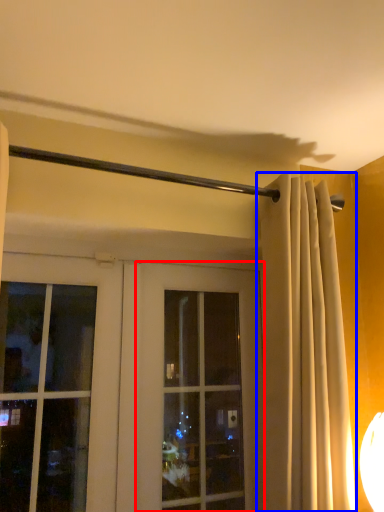
Question: Which point is closer to the camera, window (highlighted by a red box) or curtain (highlighted by a blue box)?

Choices:
 (A) window
 (B) curtain

Answer: (B)